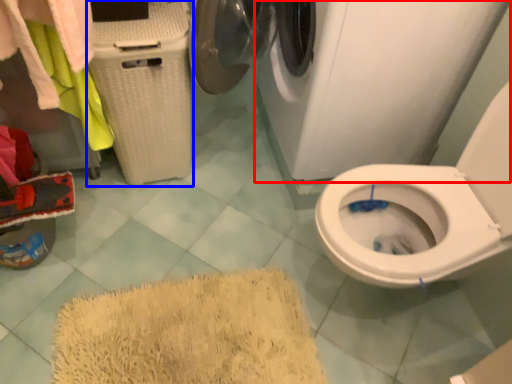
Question: Which point is further to the camera, washing machine (highlighted by a red box) or laundry basket (highlighted by a blue box)?

Choices:
 (A) washing machine
 (B) laundry basket

Answer: (B)